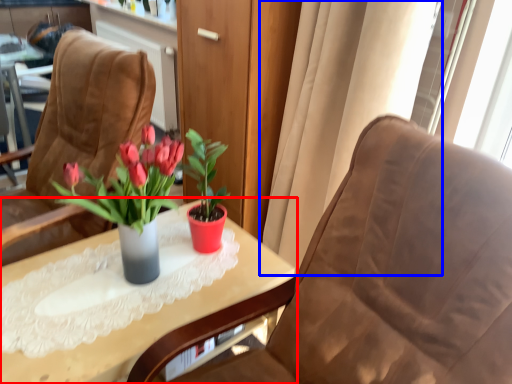
Question: Which object is further to the camera taking this photo, table (highlighted by a red box) or curtain (highlighted by a blue box)?

Choices:
 (A) table
 (B) curtain

Answer: (B)